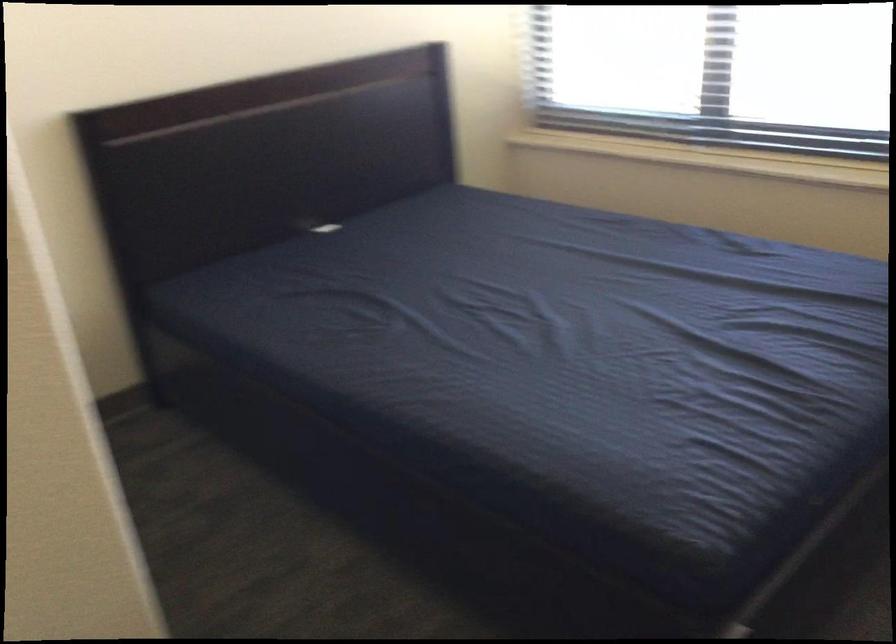
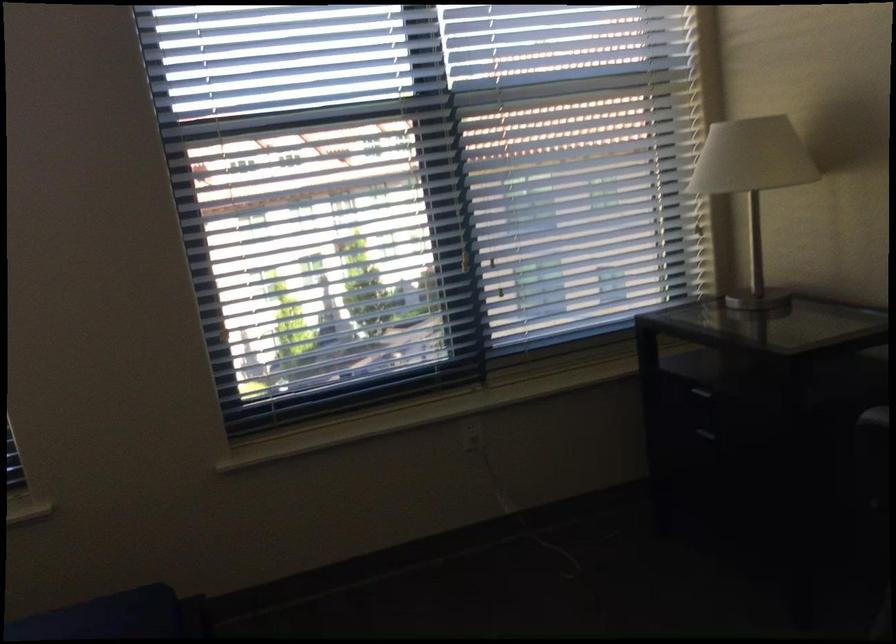
Question: Based on the continuous images, in which direction is the camera rotating? Reply with the corresponding letter.

Choices:
 (A) Left
 (B) Right
 (C) Up
 (D) Down

Answer: (B)